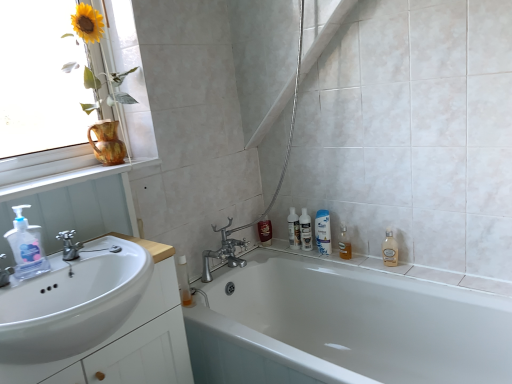
This screenshot has height=384, width=512. I want to click on vacant space to the right of chrome metallic faucet at sink left, so click(125, 254).